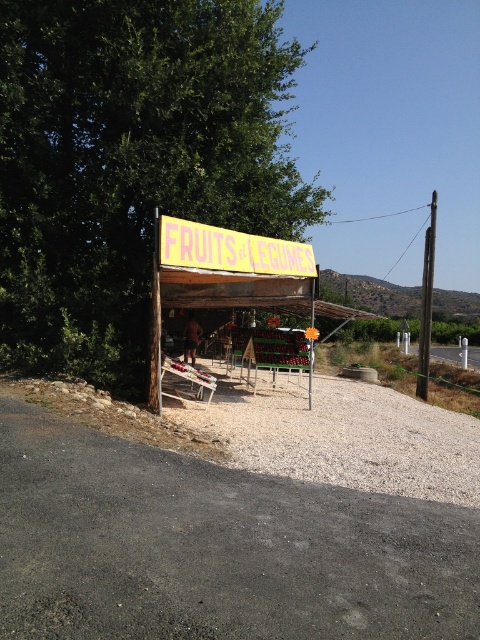
Does green leafy tree at upper left have a larger size compared to gray gravel at lower center?

Correct, green leafy tree at upper left is larger in size than gray gravel at lower center.

I want to click on green leafy tree at upper left, so click(131, 163).

Identify the location of green leafy tree at upper left. The height and width of the screenshot is (640, 480). (131, 163).

Which is in front, point (284, 156) or point (431, 257)?

Point (431, 257) is more forward.

Does green leafy tree at upper left have a smaller size compared to brown wooden pole at right?

No.

Who is more forward, (245, 189) or (427, 349)?

Point (245, 189) is more forward.

The width and height of the screenshot is (480, 640). I want to click on green leafy tree at upper left, so click(x=131, y=163).

Between gray gravel road at lower left and gray gravel at lower center, which one appears on the right side from the viewer's perspective?

From the viewer's perspective, gray gravel at lower center appears more on the right side.

Is gray gravel road at lower left shorter than gray gravel at lower center?

Indeed, gray gravel road at lower left has a lesser height compared to gray gravel at lower center.

Is point (112, 612) closer to camera compared to point (418, 406)?

Yes, it is.

Image resolution: width=480 pixels, height=640 pixels. In order to click on gray gravel road at lower left in this screenshot , I will do `click(214, 547)`.